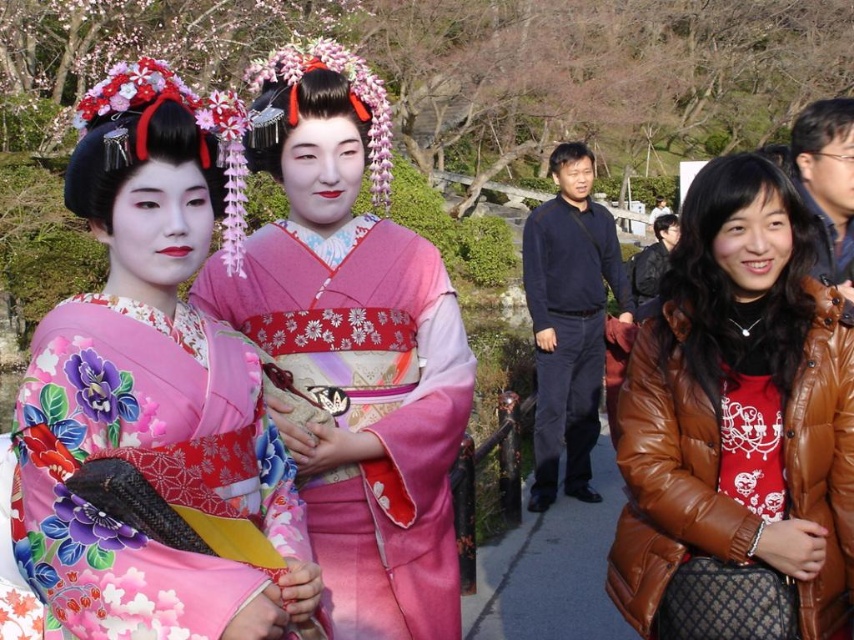
Question: Which point is farther from the camera taking this photo?

Choices:
 (A) (281, 442)
 (B) (553, 244)
 (C) (305, 195)

Answer: (B)

Question: Can you confirm if matte kimono at left is positioned above brown leather jacket at right?

Choices:
 (A) yes
 (B) no

Answer: (A)

Question: Among these objects, which one is farthest from the camera?

Choices:
 (A) matte kimono at left
 (B) matte pink kimono at center
 (C) dark blue sweater at center

Answer: (C)

Question: Does matte kimono at left have a larger size compared to brown leather jacket at right?

Choices:
 (A) no
 (B) yes

Answer: (B)

Question: Does matte kimono at left have a larger size compared to brown leather jacket at right?

Choices:
 (A) no
 (B) yes

Answer: (B)

Question: Which object is closer to the camera taking this photo?

Choices:
 (A) brown leather jacket at right
 (B) matte pink kimono at center

Answer: (A)